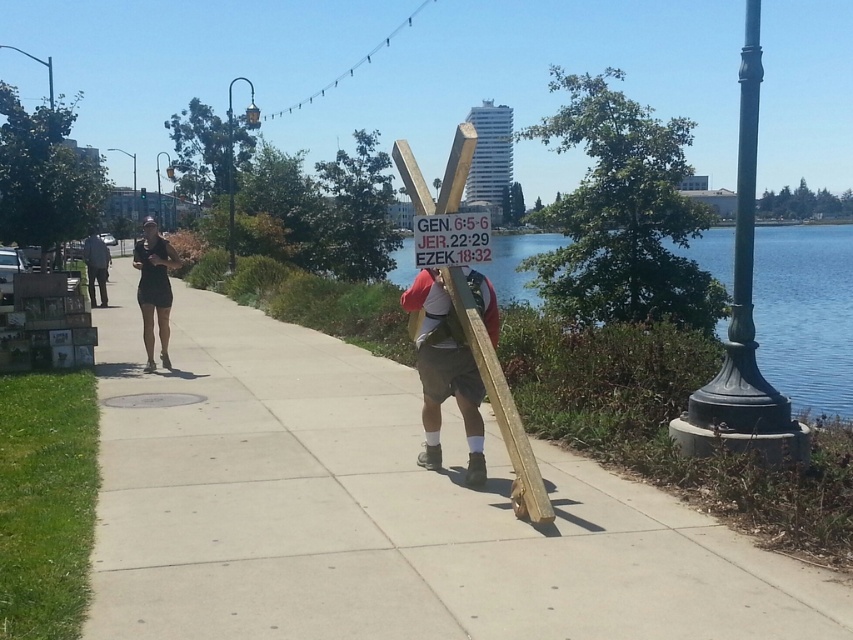
Question: Does smooth concrete sidewalk at center have a smaller size compared to green cast iron pole at right?

Choices:
 (A) no
 (B) yes

Answer: (B)

Question: Which point is closer to the camera?

Choices:
 (A) dark gray pants at center
 (B) clear blue water at center
 (C) white plastic sign at center
 (D) matte black dress at center

Answer: (B)

Question: Which is farther from the white plastic sign at center?

Choices:
 (A) brushed metal streetlight at upper center
 (B) wooden sign at center

Answer: (A)

Question: Which object is closer to the camera taking this photo?

Choices:
 (A) wooden sign at center
 (B) smooth concrete sidewalk at center
 (C) brushed metal streetlight at upper center

Answer: (B)

Question: Is matte black dress at center bigger than brushed metal streetlight at upper center?

Choices:
 (A) no
 (B) yes

Answer: (A)

Question: Can you confirm if clear blue water at center is wider than brushed metal streetlight at upper center?

Choices:
 (A) no
 (B) yes

Answer: (B)